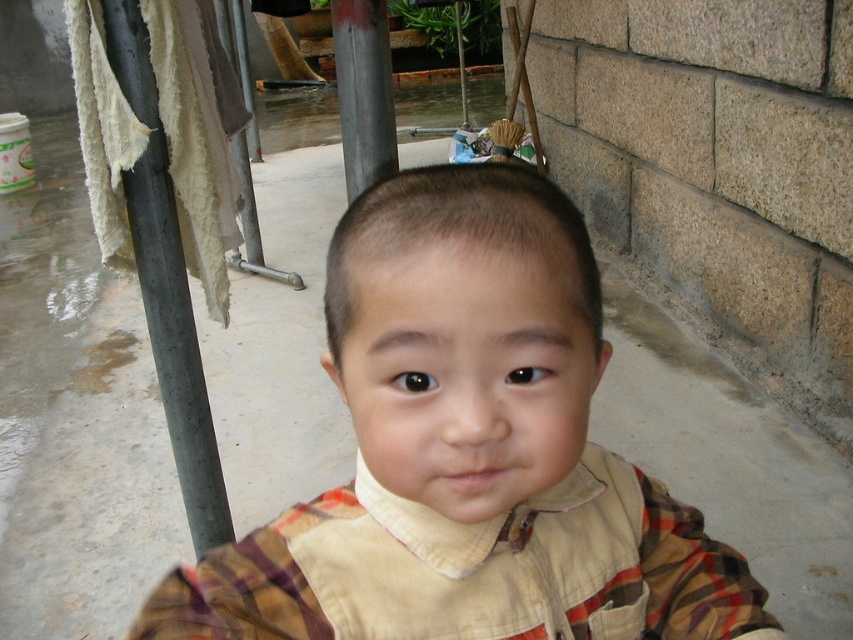
You are a photographer setting up a shoot in this scene. You want to ensure the plaid fabric at center and the metallic gray pole at left are both visible in the frame. Based on their positions, which object will appear closer to the camera?

The plaid fabric at center appears closer to the camera because it is in front of the metallic gray pole at left.

You are taking a photo of the scene and want to focus on both the point at coordinates point (x=131, y=200) and point (x=349, y=17). Which point should you focus on first to ensure both are in focus?

You should focus on point (x=131, y=200) first because it is closer to the camera than point (x=349, y=17), ensuring both points are within the depth of field.

You are a photographer setting up a shoot in this scene. You need to place a small tripod between the plaid fabric at center and the metallic gray pole at left. Which object should the tripod be closer to to ensure it fits within the available space?

The plaid fabric at center occupies less space than the metallic gray pole at left, so the tripod should be placed closer to the plaid fabric at center to ensure it fits within the available space.